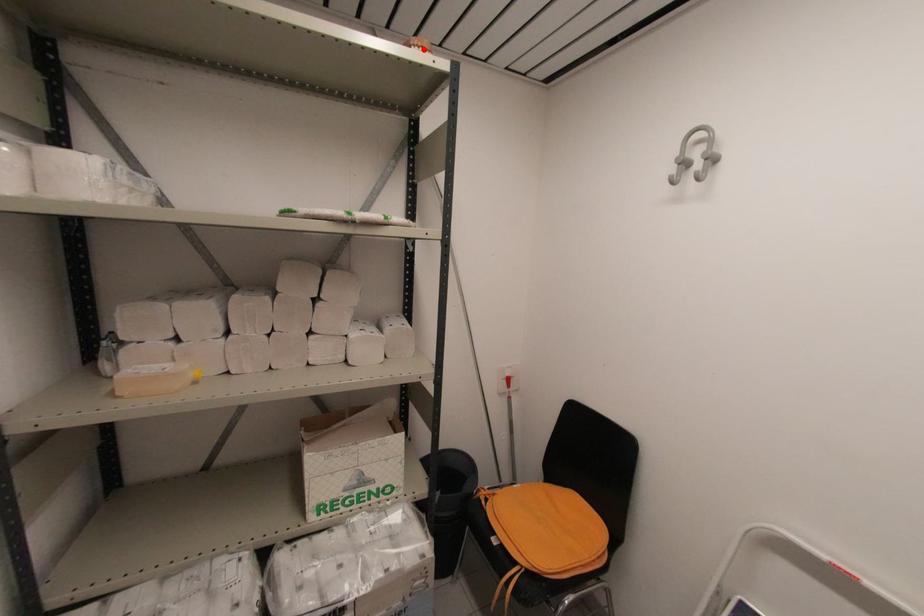
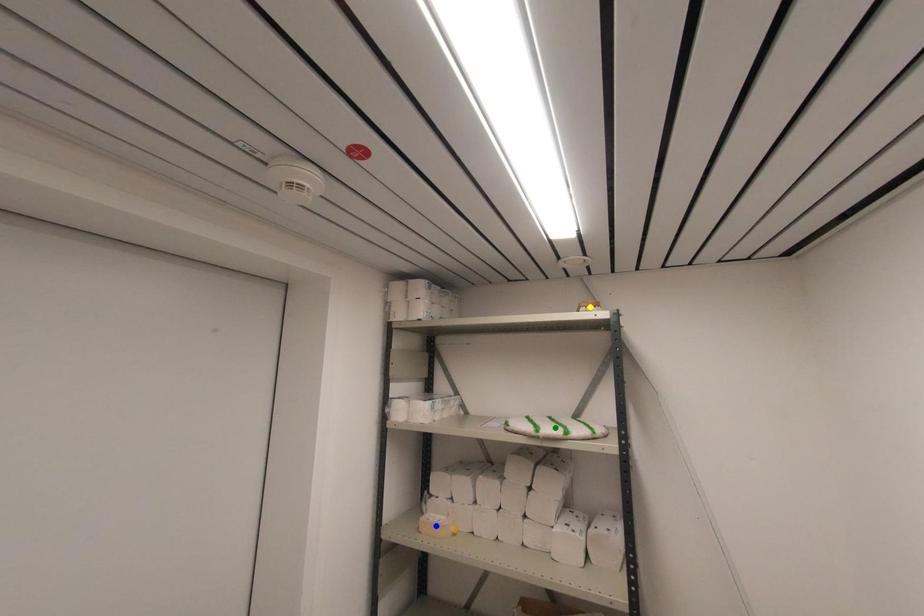
Question: I am providing you with two images of the same scene from different viewpoints. A red point is marked on the first image. You are given multiple points on the second image. Can you choose the point in image 2 that corresponds to the point in image 1?

Choices:
 (A) blue point
 (B) green point
 (C) yellow point

Answer: (C)